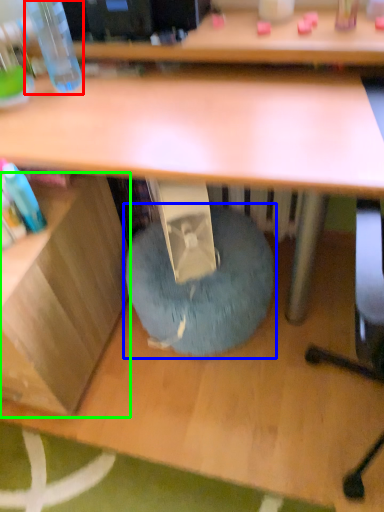
Question: Considering the real-world distances, which object is farthest from bottle (highlighted by a red box)? bean bag chair (highlighted by a blue box) or shelf (highlighted by a green box)?

Choices:
 (A) bean bag chair
 (B) shelf

Answer: (A)